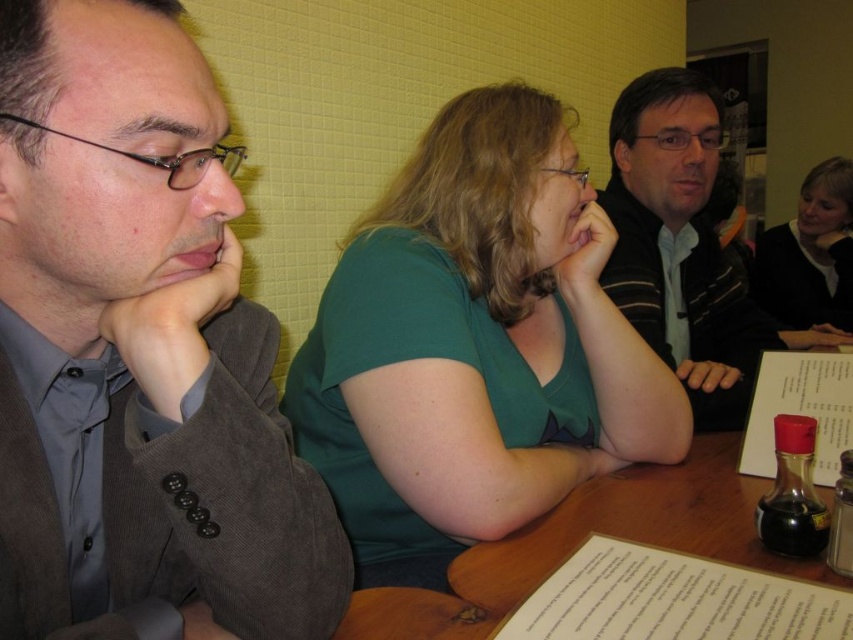
Question: Which object appears farthest from the camera in this image?

Choices:
 (A) striped sweater at center
 (B) matte gray suit at left
 (C) green matte shirt at center
 (D) white paper menu at lower center

Answer: (A)

Question: Does green matte shirt at center appear on the left side of white paper menu at lower right?

Choices:
 (A) no
 (B) yes

Answer: (B)

Question: Which point appears closest to the camera in this image?

Choices:
 (A) (376, 320)
 (B) (328, 524)
 (C) (811, 324)
 (D) (354, 614)

Answer: (B)

Question: Does matte gray suit at left appear on the right side of wooden table at center?

Choices:
 (A) no
 (B) yes

Answer: (A)

Question: Is striped sweater at center smaller than black sweater at upper right?

Choices:
 (A) yes
 (B) no

Answer: (B)

Question: Estimate the real-world distances between objects in this image. Which object is farther from the striped sweater at center?

Choices:
 (A) white paper menu at lower right
 (B) wooden table at center
 (C) black sweater at upper right
 (D) shiny dark glass bottle at lower right

Answer: (C)